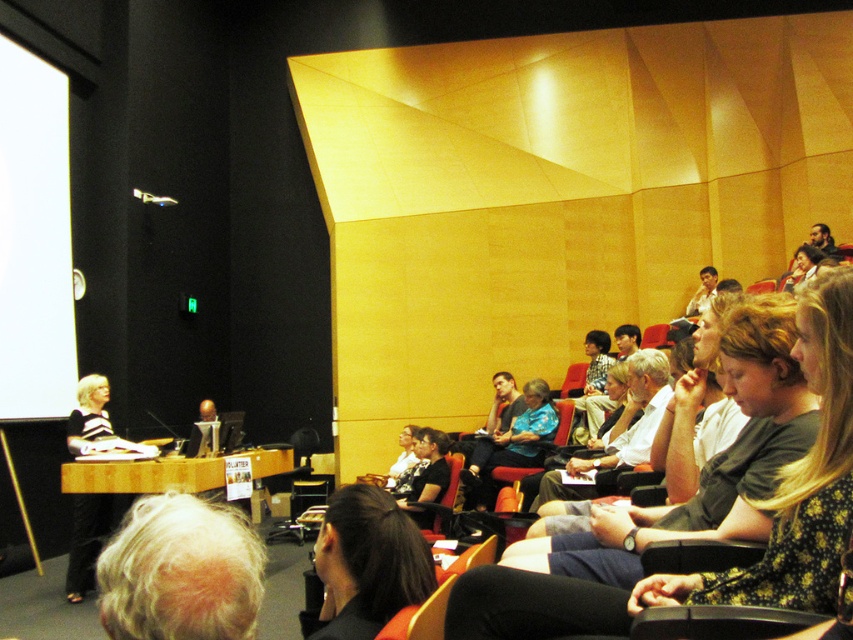
Question: Is floral-patterned shirt at center positioned behind matte black shirt at upper right?

Choices:
 (A) yes
 (B) no

Answer: (B)

Question: Considering the real-world distances, which object is farthest from the blue floral shirt at center?

Choices:
 (A) black hair at center
 (B) floral-patterned shirt at center
 (C) matte black shirt at upper right
 (D) white matte projection screen at left

Answer: (B)

Question: Which object is positioned closest to the blue floral shirt at center?

Choices:
 (A) matte black shirt at upper right
 (B) floral-patterned shirt at center
 (C) black hair at center
 (D) white matte projection screen at left

Answer: (A)

Question: Based on their relative distances, which object is nearer to the blue floral shirt at center?

Choices:
 (A) white matte projection screen at left
 (B) matte black shirt at upper right
 (C) black hair at center

Answer: (B)

Question: Is blue floral shirt at center below matte black shirt at upper right?

Choices:
 (A) yes
 (B) no

Answer: (A)

Question: Can you confirm if white matte projection screen at left is positioned to the right of matte black shirt at upper right?

Choices:
 (A) no
 (B) yes

Answer: (A)